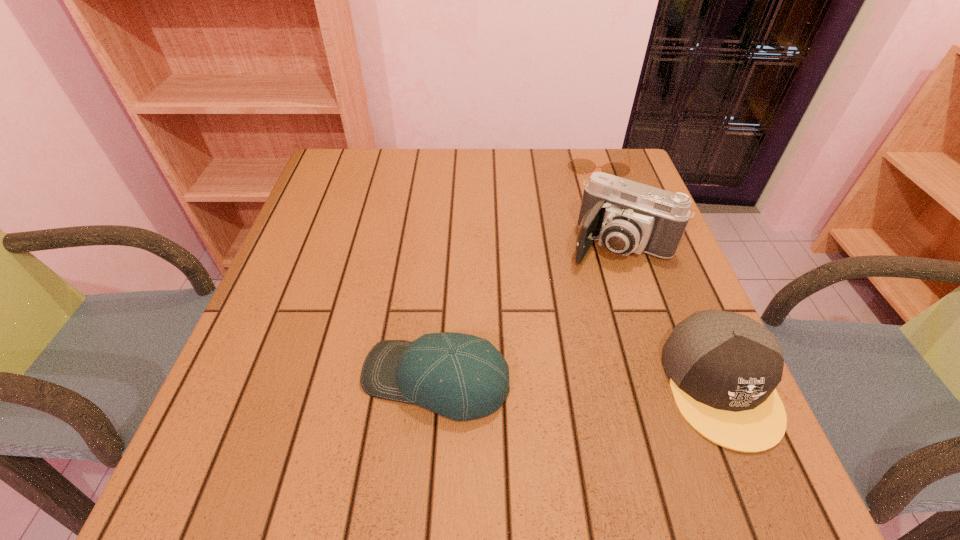
Find the location of `free space located at the front of the tallest object with an open lens cover`. free space located at the front of the tallest object with an open lens cover is located at coordinates (587, 288).

In order to click on free space located at the front of the tallest object with an open lens cover in this screenshot , I will do tap(554, 345).

At what (x,y) coordinates should I click in order to perform the action: click on free region located 0.360m at the front of the tallest object with an open lens cover. Please return your answer as a coordinate pair (x, y). This screenshot has height=540, width=960. Looking at the image, I should click on (528, 389).

Locate an element on the screen. Image resolution: width=960 pixels, height=540 pixels. object that is positioned at the far edge is located at coordinates pyautogui.click(x=580, y=165).

The image size is (960, 540). I want to click on baseball cap present at the near edge, so click(462, 377).

Image resolution: width=960 pixels, height=540 pixels. In order to click on cap that is at the near edge in this screenshot , I will do `click(723, 367)`.

Where is `cap present at the right edge`? The image size is (960, 540). cap present at the right edge is located at coordinates [x=723, y=367].

I want to click on sunglasses located at the right edge, so click(x=580, y=165).

The image size is (960, 540). What are the coordinates of `camera that is at the right edge` in the screenshot? It's located at (625, 216).

This screenshot has height=540, width=960. I want to click on object that is at the far right corner, so click(x=580, y=165).